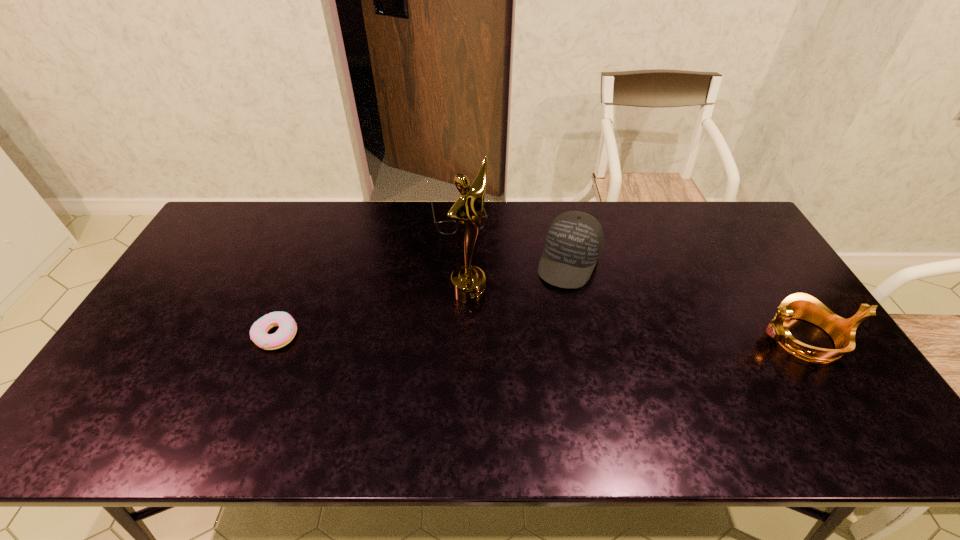
Where is `the leftmost object`? This screenshot has height=540, width=960. the leftmost object is located at coordinates (287, 329).

You are a GUI agent. You are given a task and a screenshot of the screen. Output one action in this format:
    pyautogui.click(x=<x>, y=<y>)
    Task: Click on the doughnut
    This screenshot has height=540, width=960.
    Given the screenshot: What is the action you would take?
    pyautogui.click(x=287, y=329)

Locate an element on the screen. This screenshot has width=960, height=540. tiara is located at coordinates (799, 305).

Locate an element on the screen. The width and height of the screenshot is (960, 540). the fourth object from left to right is located at coordinates (574, 241).

In order to click on the farthest object in this screenshot , I will do `click(448, 227)`.

The height and width of the screenshot is (540, 960). I want to click on the fourth tallest object, so click(448, 227).

Identify the location of award. This screenshot has height=540, width=960. click(468, 282).

Image resolution: width=960 pixels, height=540 pixels. What are the coordinates of `vacant space situated on the right of the leftmost object` in the screenshot? It's located at (430, 334).

You are a GUI agent. You are given a task and a screenshot of the screen. Output one action in this format:
    pyautogui.click(x=<x>, y=<y>)
    Task: Click on the vacant space located at the front emblem of the tiara
    Image resolution: width=960 pixels, height=540 pixels.
    Given the screenshot: What is the action you would take?
    pyautogui.click(x=634, y=339)

The width and height of the screenshot is (960, 540). I want to click on vacant space located 0.310m at the front emblem of the tiara, so click(x=644, y=339).